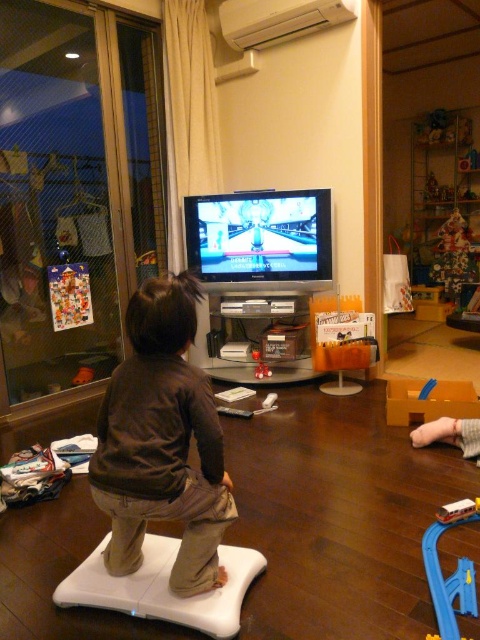
Between shiny plastic tv at center and smooth plastic train at center, which one has less height?

With less height is smooth plastic train at center.

This screenshot has width=480, height=640. What do you see at coordinates (260, 236) in the screenshot?
I see `shiny plastic tv at center` at bounding box center [260, 236].

Who is more distant from viewer, (x=304, y=252) or (x=468, y=595)?

Positioned behind is point (x=304, y=252).

You are a GUI agent. You are given a task and a screenshot of the screen. Output one action in this format:
    pyautogui.click(x=<x>, y=<y>)
    Task: Click on the shiny plastic tv at center
    
    Given the screenshot: What is the action you would take?
    pyautogui.click(x=260, y=236)

Does point (186, 305) come closer to viewer compared to point (322, 266)?

That is True.

Is point (192, 310) positioned behind point (218, 275)?

No, it is not.

At what (x,y) coordinates should I click in order to perform the action: click on brown cotton toddler at center. Please return your answer as a coordinate pair (x, y). Looking at the image, I should click on (162, 442).

Does point (205, 529) lie in front of point (439, 520)?

Yes, point (205, 529) is in front of point (439, 520).

Is point (155, 403) positioned before point (455, 636)?

No.

This screenshot has width=480, height=640. I want to click on brown cotton toddler at center, so click(162, 442).